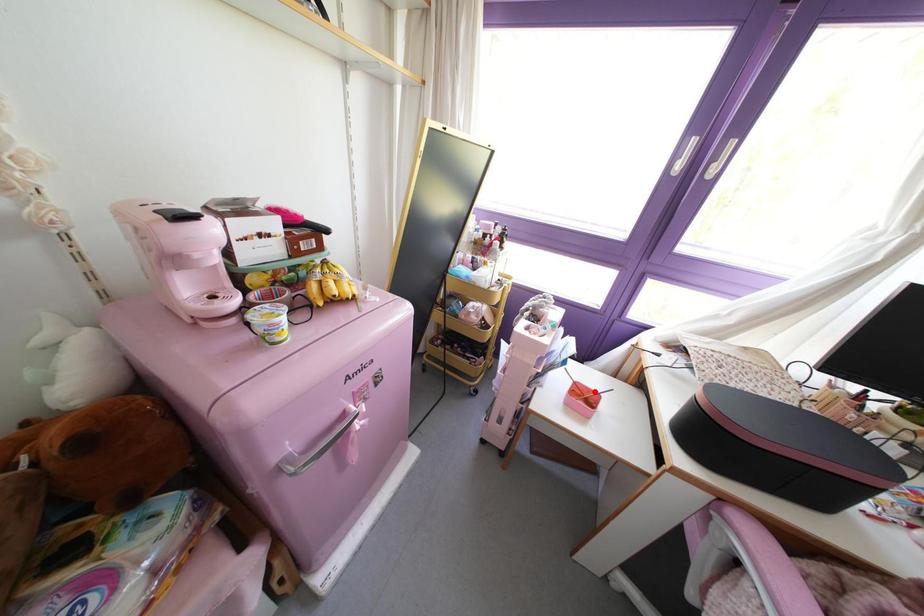
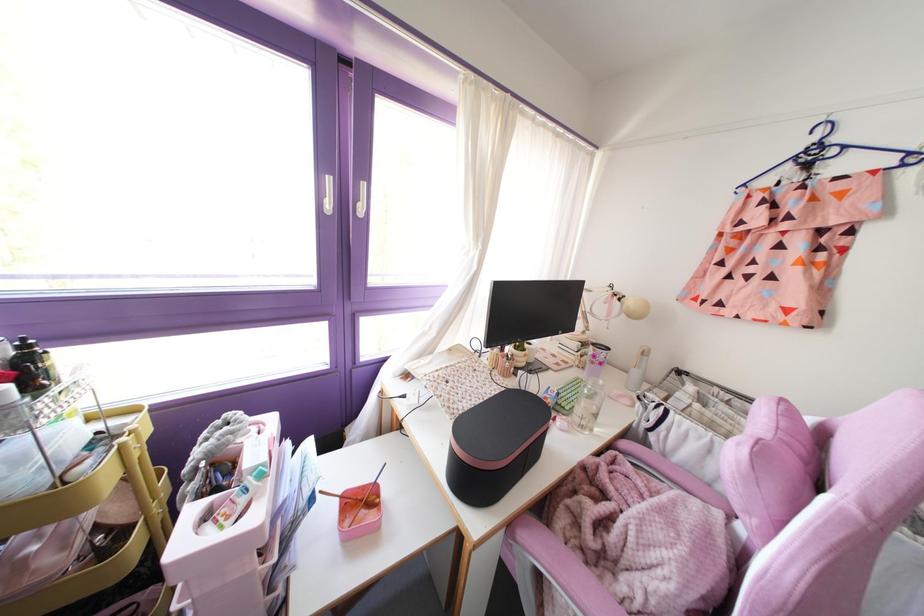
Question: A red point is marked in image1. In image2, is the corresponding 3D point closer to the camera or farther? Reply with the corresponding letter.

Choices:
 (A) The corresponding 3D point is closer.
 (B) The corresponding 3D point is farther.

Answer: (A)